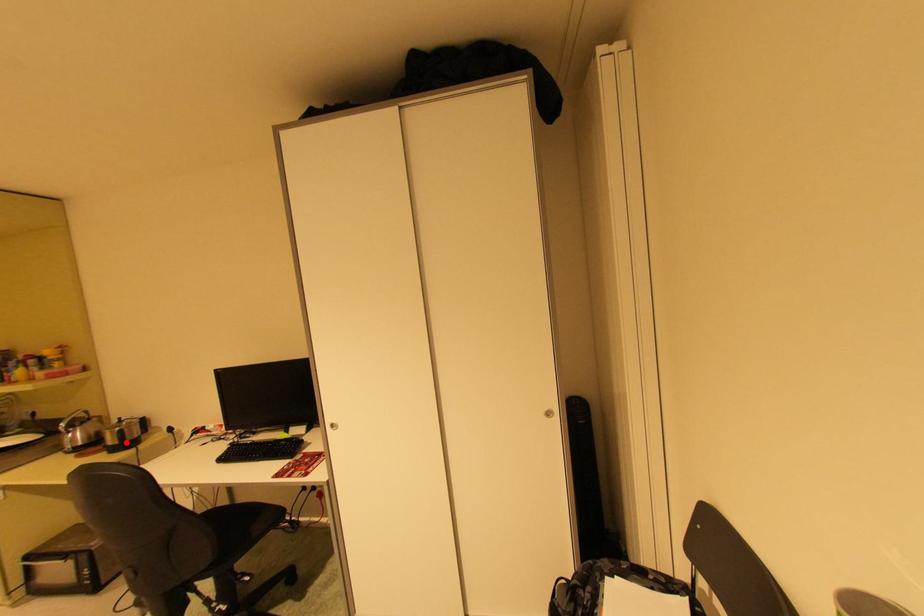
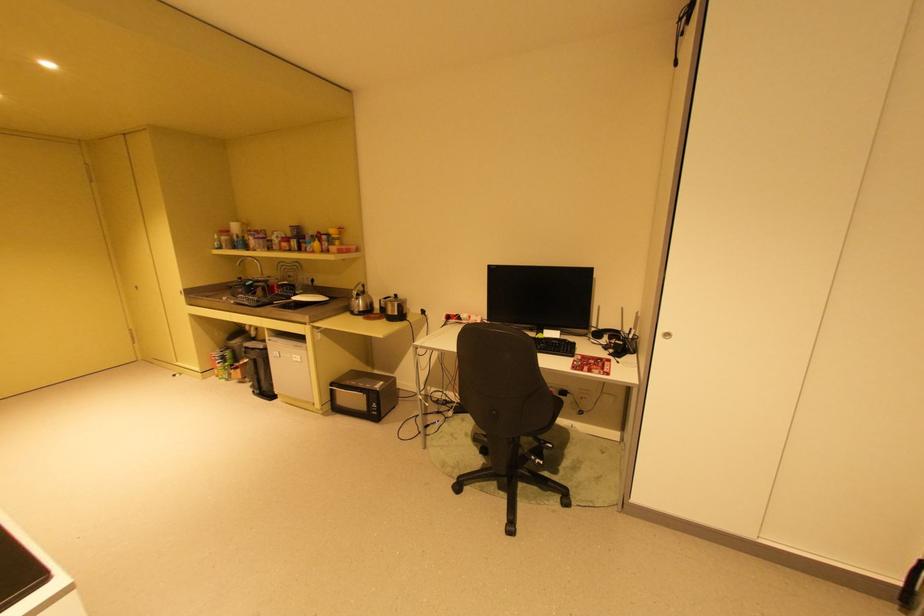
Find the pixel in the second image that matches the highlighted location in the first image.

(404, 314)